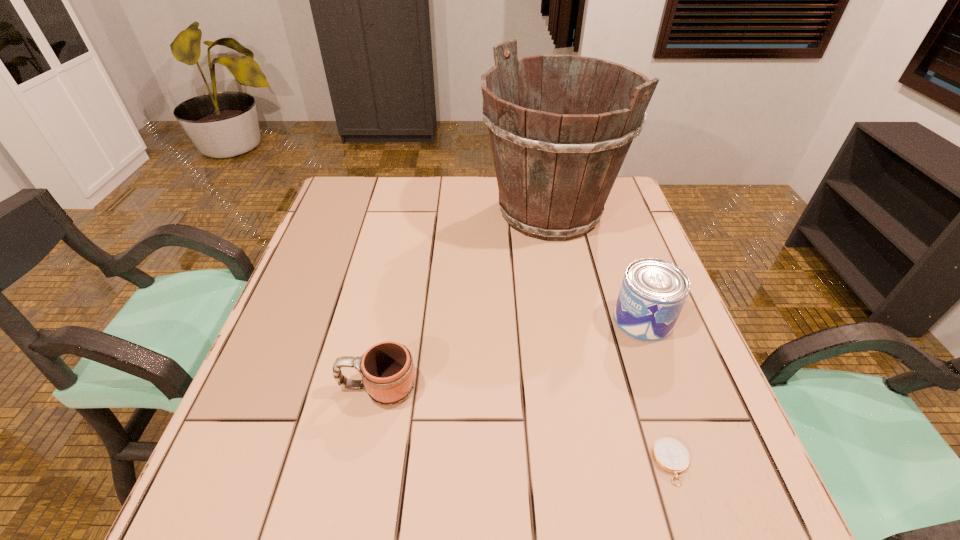
The image size is (960, 540). I want to click on vacant space that satisfies the following two spatial constraints: 1. on the side of the nearest object with the handle; 2. on the right side of the leftmost object, so pos(363,463).

This screenshot has height=540, width=960. I want to click on free space that satisfies the following two spatial constraints: 1. on the front side of the tallest object; 2. on the side of the second nearest object with the handle, so click(x=585, y=388).

At what (x,y) coordinates should I click in order to perform the action: click on free space that satisfies the following two spatial constraints: 1. on the front side of the farthest object; 2. on the right side of the nearest object. Please return your answer as a coordinate pair (x, y). The width and height of the screenshot is (960, 540). Looking at the image, I should click on (600, 463).